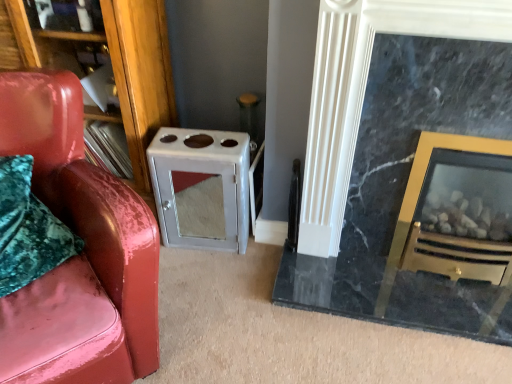
Where is `glossy leather chair at left`? glossy leather chair at left is located at coordinates (81, 254).

Identify the location of black marble fireplace at right. (407, 166).

What do you see at coordinates (201, 188) in the screenshot? The height and width of the screenshot is (384, 512). I see `satin silver cabinet at center` at bounding box center [201, 188].

This screenshot has height=384, width=512. In order to click on glossy leather chair at left in this screenshot , I will do tap(81, 254).

Is wooden bookshelf at left not near glossy leather chair at left?

They are positioned close to each other.

Choose the correct answer: Is wooden bookshelf at left inside glossy leather chair at left or outside it?

wooden bookshelf at left is located beyond the bounds of glossy leather chair at left.

Considering the sizes of wooden bookshelf at left and glossy leather chair at left in the image, is wooden bookshelf at left taller or shorter than glossy leather chair at left?

Considering their sizes, wooden bookshelf at left has less height than glossy leather chair at left.

Based on the photo, from a real-world perspective, is glossy leather chair at left under satin silver cabinet at center?

No.

Which of these two, glossy leather chair at left or satin silver cabinet at center, stands taller?

glossy leather chair at left is taller.

Consider the image. Considering the positions of objects glossy leather chair at left and satin silver cabinet at center in the image provided, who is in front, glossy leather chair at left or satin silver cabinet at center?

glossy leather chair at left is in front.

From the image's perspective, relative to satin silver cabinet at center, is glossy leather chair at left above or below?

From the image's perspective, glossy leather chair at left appears below satin silver cabinet at center.

In terms of width, does wooden bookshelf at left look wider or thinner when compared to satin silver cabinet at center?

wooden bookshelf at left is wider than satin silver cabinet at center.

Where is `bookshelf positioned vertically above the satin silver cabinet at center (from a real-world perspective)`? The height and width of the screenshot is (384, 512). bookshelf positioned vertically above the satin silver cabinet at center (from a real-world perspective) is located at coordinates (141, 74).

Which of these two, wooden bookshelf at left or satin silver cabinet at center, stands shorter?

With less height is satin silver cabinet at center.

Is wooden bookshelf at left inside or outside of black marble fireplace at right?

wooden bookshelf at left is not inside black marble fireplace at right, it's outside.

Is point (134, 82) positioned behind point (424, 114)?

Yes, point (134, 82) is behind point (424, 114).

Is wooden bookshelf at left turned away from black marble fireplace at right?

That's not correct — wooden bookshelf at left is not looking away from black marble fireplace at right.

How distant is wooden bookshelf at left from black marble fireplace at right?

They are 35.85 inches apart.

Is satin silver cabinet at center spatially inside black marble fireplace at right, or outside of it?

satin silver cabinet at center cannot be found inside black marble fireplace at right.

From a real-world perspective, is satin silver cabinet at center on top of black marble fireplace at right?

No, from a real-world perspective, satin silver cabinet at center is not above black marble fireplace at right.

Is satin silver cabinet at center bigger or smaller than black marble fireplace at right?

satin silver cabinet at center is smaller than black marble fireplace at right.

Based on the photo, which is more to the left, glossy leather chair at left or wooden bookshelf at left?

wooden bookshelf at left is more to the left.

Is glossy leather chair at left placed right next to wooden bookshelf at left?

glossy leather chair at left and wooden bookshelf at left are not in contact.

From a real-world perspective, which is physically below, glossy leather chair at left or wooden bookshelf at left?

From a 3D spatial view, glossy leather chair at left is below.

Is glossy leather chair at left located outside wooden bookshelf at left?

That's correct, glossy leather chair at left is outside of wooden bookshelf at left.

Is glossy leather chair at left taller or shorter than black marble fireplace at right?

glossy leather chair at left is shorter than black marble fireplace at right.

Can you confirm if glossy leather chair at left is wider than black marble fireplace at right?

Yes.

Would you say glossy leather chair at left is outside black marble fireplace at right?

Indeed, glossy leather chair at left is completely outside black marble fireplace at right.

Who is smaller, glossy leather chair at left or black marble fireplace at right?

Smaller between the two is black marble fireplace at right.

Where is `chair beneath the wooden bookshelf at left (from a real-world perspective)`? Image resolution: width=512 pixels, height=384 pixels. chair beneath the wooden bookshelf at left (from a real-world perspective) is located at coordinates (81, 254).

This screenshot has height=384, width=512. Identify the location of appliance on the right of glossy leather chair at left. (201, 188).

Estimate the real-world distances between objects in this image. Which object is further from glossy leather chair at left, satin silver cabinet at center or black marble fireplace at right?

black marble fireplace at right is positioned further to the anchor glossy leather chair at left.

From the image, which object appears to be farther from wooden bookshelf at left, black marble fireplace at right or glossy leather chair at left?

black marble fireplace at right lies further to wooden bookshelf at left than the other object.

When comparing their distances from satin silver cabinet at center, does wooden bookshelf at left or glossy leather chair at left seem closer?

wooden bookshelf at left is closer to satin silver cabinet at center.

From the image, which object appears to be farther from wooden bookshelf at left, satin silver cabinet at center or black marble fireplace at right?

black marble fireplace at right is further to wooden bookshelf at left.

Which object lies nearer to the anchor point black marble fireplace at right, satin silver cabinet at center or glossy leather chair at left?

satin silver cabinet at center.

Estimate the real-world distances between objects in this image. Which object is closer to satin silver cabinet at center, black marble fireplace at right or glossy leather chair at left?

Among the two, glossy leather chair at left is located nearer to satin silver cabinet at center.

Estimate the real-world distances between objects in this image. Which object is further from satin silver cabinet at center, glossy leather chair at left or wooden bookshelf at left?

glossy leather chair at left is further to satin silver cabinet at center.

Which object lies further to the anchor point glossy leather chair at left, wooden bookshelf at left or satin silver cabinet at center?

Among the two, satin silver cabinet at center is located further to glossy leather chair at left.

I want to click on appliance located between glossy leather chair at left and black marble fireplace at right in the left-right direction, so click(x=201, y=188).

Where is `chair between wooden bookshelf at left and black marble fireplace at right in the horizontal direction`? The height and width of the screenshot is (384, 512). chair between wooden bookshelf at left and black marble fireplace at right in the horizontal direction is located at coordinates (x=81, y=254).

You are a GUI agent. You are given a task and a screenshot of the screen. Output one action in this format:
    pyautogui.click(x=<x>, y=<y>)
    Task: Click on the appliance situated between wooden bookshelf at left and black marble fireplace at right from left to right
    
    Given the screenshot: What is the action you would take?
    pyautogui.click(x=201, y=188)

At what (x,y) coordinates should I click in order to perform the action: click on bookshelf between glossy leather chair at left and satin silver cabinet at center from front to back. Please return your answer as a coordinate pair (x, y). The width and height of the screenshot is (512, 384). Looking at the image, I should click on (141, 74).